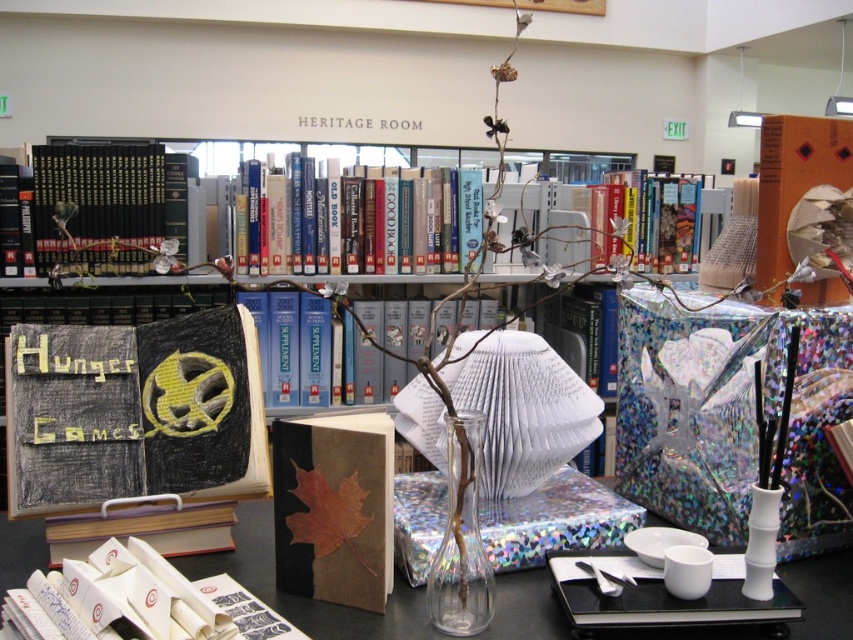
Question: Is brown paper book at center wider than transparent glass vase at center?

Choices:
 (A) yes
 (B) no

Answer: (A)

Question: Which point is farther from the camera taking this photo?

Choices:
 (A) (461, 525)
 (B) (665, 224)
 (C) (368, 561)
 (D) (102, 262)

Answer: (B)

Question: Which object is positioned farthest from the hardcover books at center?

Choices:
 (A) black chalkboard book at center
 (B) brown matte book at center
 (C) transparent glass vase at center

Answer: (C)

Question: Estimate the real-world distances between objects in this image. Which object is farther from the brown matte book at center?

Choices:
 (A) brown paper book at center
 (B) hardcover books at upper left
 (C) transparent glass vase at center

Answer: (B)

Question: Can you confirm if brown paper book at center is positioned to the right of hardcover book at center?

Choices:
 (A) yes
 (B) no

Answer: (B)

Question: Can you confirm if black chalkboard book at center is wider than hardcover book at center?

Choices:
 (A) no
 (B) yes

Answer: (A)